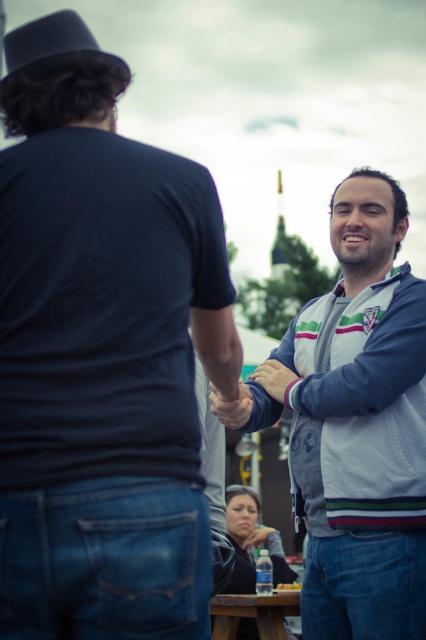
Question: Which of the following is the farthest from the observer?

Choices:
 (A) white cotton jacket at right
 (B) black felt fedora at upper left
 (C) white striped jacket at center

Answer: (C)

Question: Can you confirm if white cotton jacket at right is positioned to the right of white striped jacket at center?

Choices:
 (A) yes
 (B) no

Answer: (B)

Question: Which object appears farthest from the camera in this image?

Choices:
 (A) white striped jacket at center
 (B) brown wooden picnic table at lower center
 (C) white cotton jacket at right
 (D) black felt fedora at upper left

Answer: (B)

Question: Where is white cotton jacket at right located in relation to brown wooden picnic table at lower center in the image?

Choices:
 (A) left
 (B) right

Answer: (A)

Question: Is white cotton jacket at right closer to the viewer compared to white striped jacket at center?

Choices:
 (A) no
 (B) yes

Answer: (B)

Question: Among these objects, which one is farthest from the camera?

Choices:
 (A) white cotton jacket at right
 (B) white striped jacket at center

Answer: (B)